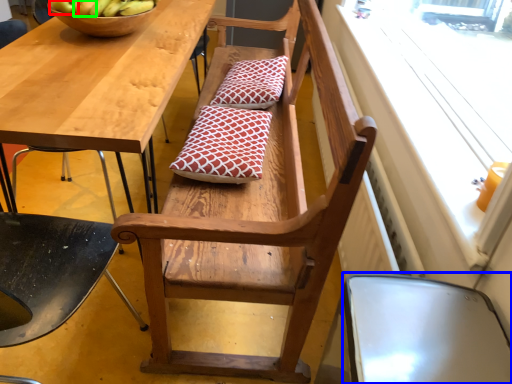
Question: Estimate the real-world distances between objects in this image. Which object is farther from apple (highlighted by a red box), chair (highlighted by a blue box) or apple (highlighted by a green box)?

Choices:
 (A) chair
 (B) apple

Answer: (A)